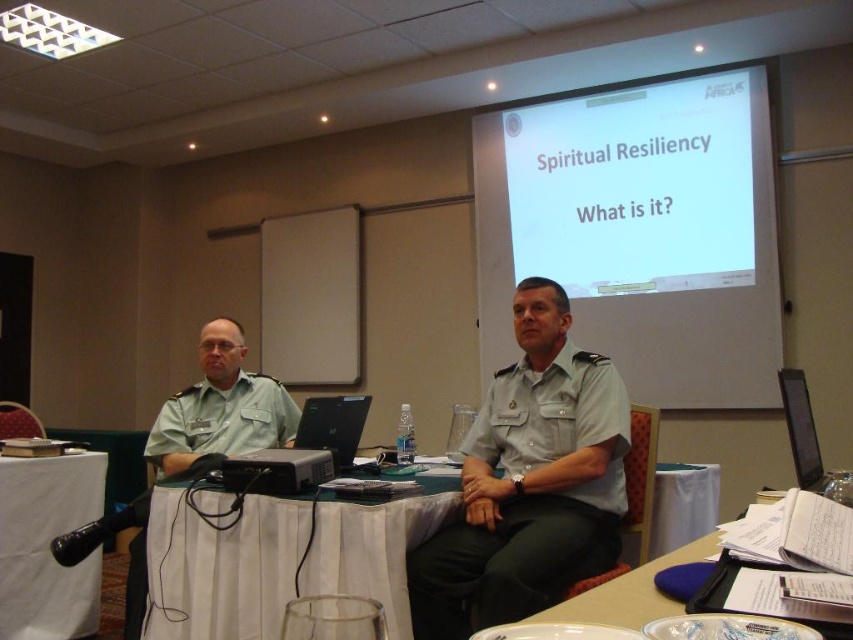
What do you see at coordinates (277, 557) in the screenshot?
I see `white cloth-covered table at center` at bounding box center [277, 557].

Between point (184, 602) and point (357, 396), which one is positioned behind?

The point (357, 396) is behind.

Is point (241, 605) closer to viewer compared to point (345, 413)?

Yes.

You are a GUI agent. You are given a task and a screenshot of the screen. Output one action in this format:
    pyautogui.click(x=<x>, y=<y>)
    Task: Click on the white cloth-covered table at center
    
    Given the screenshot: What is the action you would take?
    pyautogui.click(x=277, y=557)

Does point (349, 582) come closer to viewer compared to point (239, 458)?

Yes, it is.

Does white cloth-covered table at center appear on the right side of black plastic projector at center?

Yes, white cloth-covered table at center is to the right of black plastic projector at center.

Identify the location of white cloth-covered table at center. (277, 557).

Identify the location of light gray uniform at center. This screenshot has width=853, height=640. (529, 483).

Between light gray uniform at center and white cloth table at lower left, which one appears on the left side from the viewer's perspective?

Positioned to the left is white cloth table at lower left.

Is point (550, 394) farther from viewer compared to point (1, 518)?

That is False.

Where is `light gray uniform at center`? The width and height of the screenshot is (853, 640). light gray uniform at center is located at coordinates (529, 483).